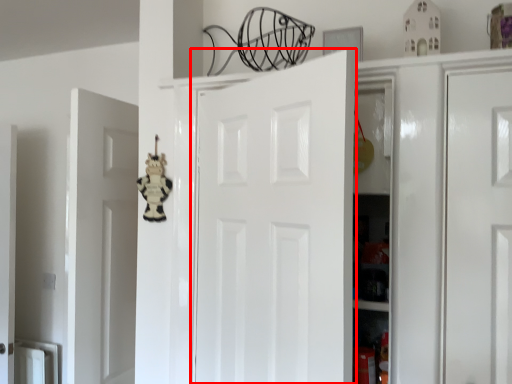
Question: From the image's perspective, considering the relative positions of door (annotated by the red box) and toy in the image provided, where is door (annotated by the red box) located with respect to the staircase?

Choices:
 (A) above
 (B) below

Answer: (B)